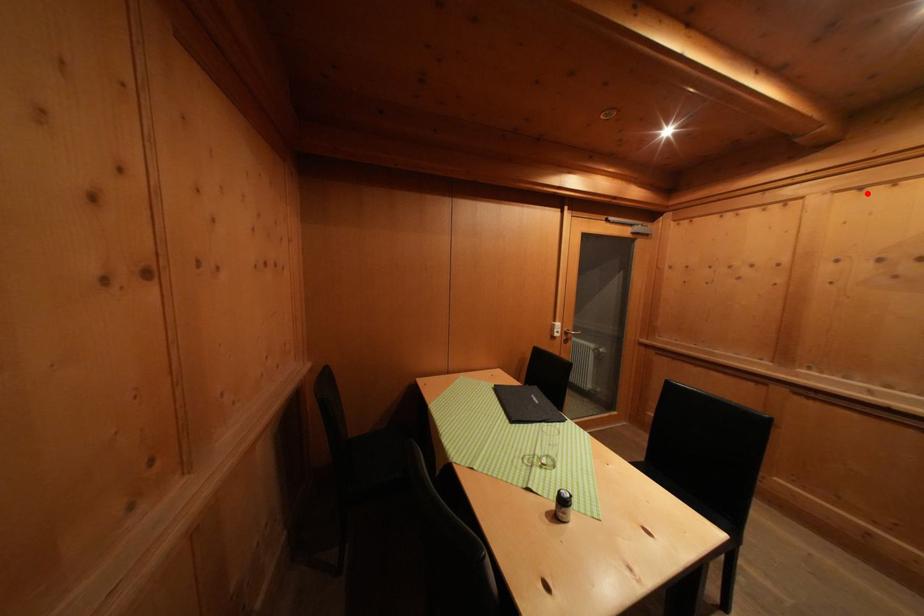
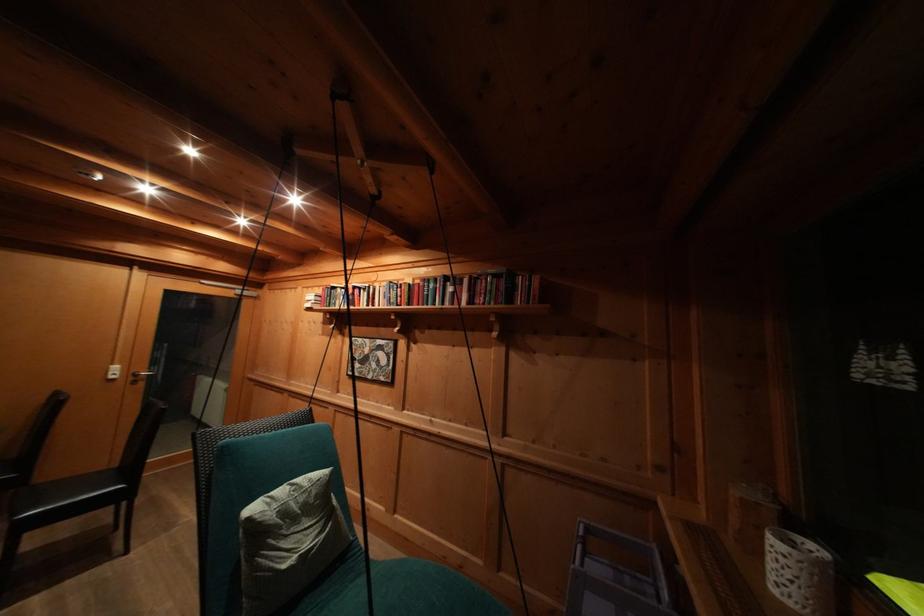
Where in the second image is the point corresponding to the highlighted location from the first image?

(313, 293)